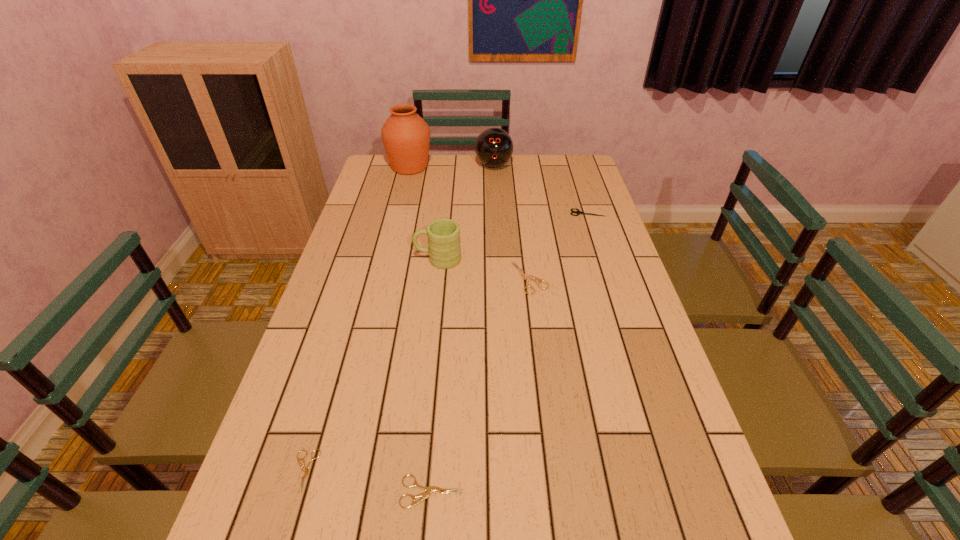
In order to click on urn in this screenshot , I will do `click(406, 136)`.

Image resolution: width=960 pixels, height=540 pixels. Find the location of `brown urn`. brown urn is located at coordinates (406, 136).

This screenshot has width=960, height=540. I want to click on black bowling ball, so coord(494,147).

The width and height of the screenshot is (960, 540). What are the coordinates of `the second tallest object` in the screenshot? It's located at (494, 147).

Where is `green mug`? This screenshot has width=960, height=540. green mug is located at coordinates (443, 235).

Locate an element on the screen. The height and width of the screenshot is (540, 960). the third tallest object is located at coordinates (443, 235).

This screenshot has width=960, height=540. I want to click on the rightmost shears, so click(578, 212).

You are a GUI agent. You are given a task and a screenshot of the screen. Output one action in this format:
    pyautogui.click(x=<x>, y=<y>)
    Task: Click on the black shears
    
    Given the screenshot: What is the action you would take?
    pyautogui.click(x=578, y=212)

Locate an element on the screen. The width and height of the screenshot is (960, 540). the second farthest shears is located at coordinates (524, 276).

At what (x,y) coordinates should I click in order to perform the action: click on the rightmost beige shears. Please return your answer as a coordinate pair (x, y). Looking at the image, I should click on (524, 276).